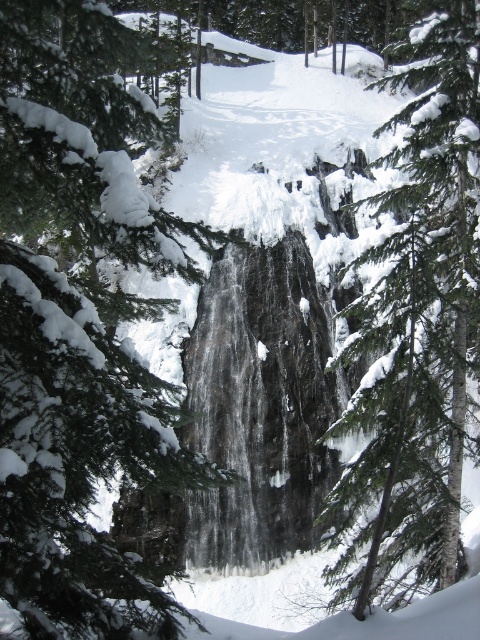
Question: Does green textured pine tree at center appear under green textured tree at center?

Choices:
 (A) no
 (B) yes

Answer: (B)

Question: In this image, where is green textured pine tree at center located relative to green textured tree at center?

Choices:
 (A) right
 (B) left

Answer: (B)

Question: Among these objects, which one is farthest from the camera?

Choices:
 (A) green textured pine tree at center
 (B) green textured tree at center

Answer: (A)

Question: Does green textured pine tree at center have a smaller size compared to green textured tree at center?

Choices:
 (A) yes
 (B) no

Answer: (A)

Question: Which point appears closest to the camera in this image?

Choices:
 (A) (84, 278)
 (B) (346, 563)

Answer: (B)